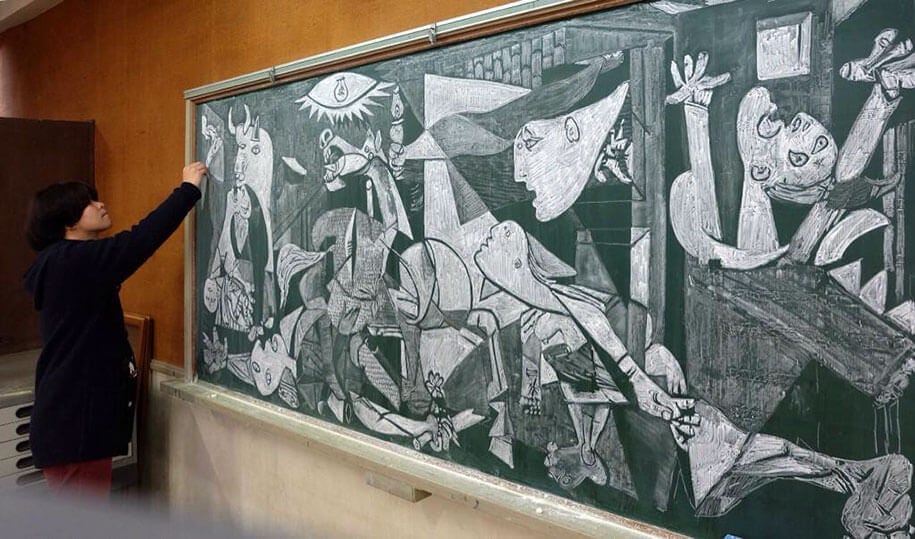
Where is `piano keys`? The height and width of the screenshot is (539, 915). piano keys is located at coordinates (11, 480), (6, 461), (9, 429), (11, 411).